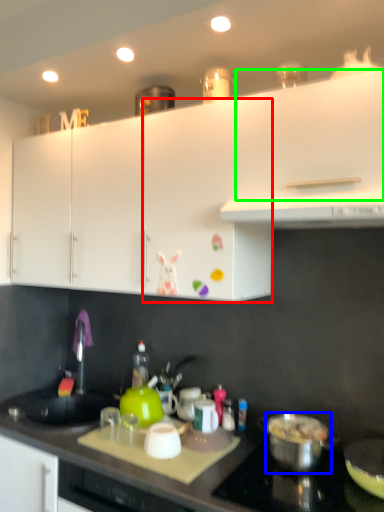
Question: Which is farther away from cabinetry (highlighted by a red box)? kitchen appliance (highlighted by a blue box) or cabinetry (highlighted by a green box)?

Choices:
 (A) kitchen appliance
 (B) cabinetry

Answer: (A)